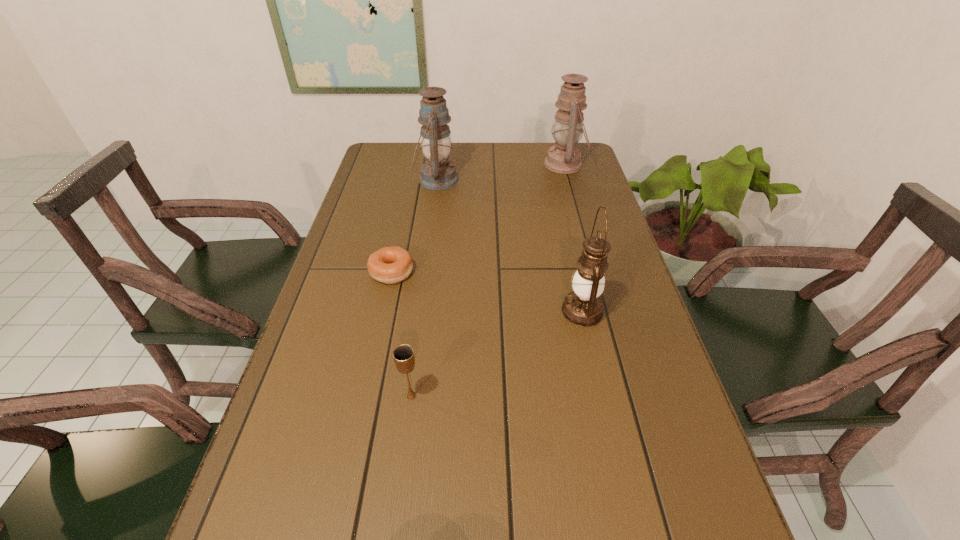
Locate an element on the screen. This screenshot has height=540, width=960. the leftmost oil lamp is located at coordinates (438, 173).

The height and width of the screenshot is (540, 960). Find the location of `the nearest oil lamp`. the nearest oil lamp is located at coordinates (583, 307).

At what (x,y) coordinates should I click in order to perform the action: click on chalice. Please return your answer as a coordinate pair (x, y). The width and height of the screenshot is (960, 540). Looking at the image, I should click on (403, 355).

I want to click on the nearest object, so 403,355.

Locate an element on the screen. the third farthest object is located at coordinates (390, 265).

Where is `bagel`? The width and height of the screenshot is (960, 540). bagel is located at coordinates (390, 265).

Identify the location of vacant space located on the front of the leftmost oil lamp. (423, 276).

I want to click on free space located on the front of the nearest oil lamp, so click(x=604, y=408).

Image resolution: width=960 pixels, height=540 pixels. In order to click on vacant area situated on the right of the chalice in this screenshot , I will do `click(465, 396)`.

Where is `vacant region located on the front of the third nearest object`? The image size is (960, 540). vacant region located on the front of the third nearest object is located at coordinates (385, 303).